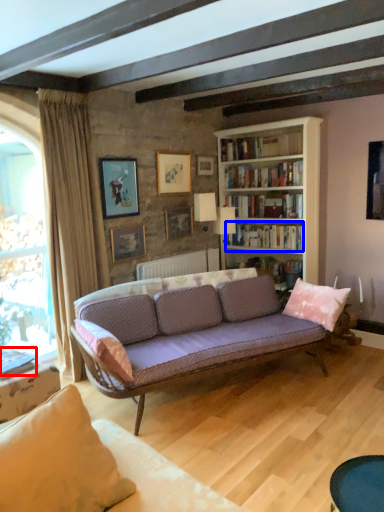
Question: Which point is further to the camera, book (highlighted by a red box) or book (highlighted by a blue box)?

Choices:
 (A) book
 (B) book

Answer: (B)